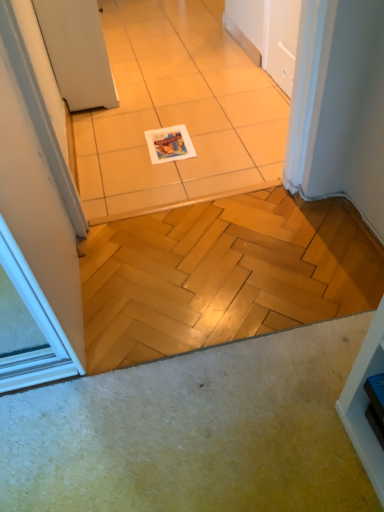
This screenshot has width=384, height=512. Identify the location of white glossy tile at center. point(177,111).

You are a GUI agent. You are given a task and a screenshot of the screen. Output one action in this format:
    pyautogui.click(x=<x>, y=<y>)
    Task: Click on the white glossy magazine at center
    This screenshot has height=512, width=384.
    Given the screenshot: What is the action you would take?
    pyautogui.click(x=169, y=144)

You are a GUI agent. You are given a task and a screenshot of the screen. Output one action in this format:
    pyautogui.click(x=<x>, y=<y>)
    Task: Click on the white glossy tile at center
    
    Given the screenshot: What is the action you would take?
    pyautogui.click(x=177, y=111)

Would you consider white glossy magazine at center to be distant from white glossy tile at center?

No.

Does point (165, 138) appear closer or farther from the camera than point (169, 42)?

Clearly, point (165, 138) is closer to the camera than point (169, 42).

Can you confirm if white glossy magazine at center is smaller than white glossy tile at center?

Indeed, white glossy magazine at center has a smaller size compared to white glossy tile at center.

Image resolution: width=384 pixels, height=512 pixels. Identify the location of magazine on the right of white glossy tile at center. (169, 144).

Is point (191, 178) closer or farther from the camera than point (59, 69)?

Point (191, 178).

In order to click on ceramic tile in front of the white matte door at upper left in this screenshot , I will do `click(177, 111)`.

Are white glossy tile at center and white matte door at upper left making contact?

No, white glossy tile at center is not touching white matte door at upper left.

Find the location of a particular element. The width and height of the screenshot is (384, 512). magazine below the white matte door at upper left (from a real-world perspective) is located at coordinates (169, 144).

Does white matte door at upper left appear on the right side of white glossy magazine at center?

Incorrect, white matte door at upper left is not on the right side of white glossy magazine at center.

Between white matte door at upper left and white glossy magazine at center, which one is positioned behind?

white glossy magazine at center.

Based on the photo, is white matte door at upper left bigger or smaller than white glossy magazine at center?

In the image, white matte door at upper left appears to be larger than white glossy magazine at center.

Would you say white glossy magazine at center is part of white glossy tile at center's contents?

Yes, white glossy magazine at center is a part of white glossy tile at center.

Does white glossy tile at center have a lesser width compared to white glossy magazine at center?

No, white glossy tile at center is not thinner than white glossy magazine at center.

The width and height of the screenshot is (384, 512). There is a white glossy tile at center. In order to click on magazine above it (from a real-world perspective) in this screenshot , I will do `click(169, 144)`.

Which is closer, (240, 161) or (188, 136)?

Point (240, 161) appears to be closer to the viewer than point (188, 136).

How many degrees apart are the facing directions of white glossy magazine at center and white matte door at upper left?

The facing directions of white glossy magazine at center and white matte door at upper left are 91.5 degrees apart.

Is white glossy magazine at center not close to white matte door at upper left?

They are positioned close to each other.

From the image's perspective, would you say white glossy magazine at center is shown under white matte door at upper left?

Yes, from the image's perspective, white glossy magazine at center is below white matte door at upper left.

Does point (175, 158) come closer to viewer compared to point (97, 53)?

Yes, it is.

Does point (54, 18) appear closer or farther from the camera than point (101, 3)?

Clearly, point (54, 18) is closer to the camera than point (101, 3).

You are a GUI agent. You are given a task and a screenshot of the screen. Output one action in this format:
    pyautogui.click(x=<x>, y=<y>)
    Task: Click on the ceramic tile located underneath the white matte door at upper left (from a real-world perspective)
    The height and width of the screenshot is (512, 384).
    Given the screenshot: What is the action you would take?
    pyautogui.click(x=177, y=111)

Is white matte door at upper left smaller than white glossy tile at center?

Actually, white matte door at upper left might be larger than white glossy tile at center.

Who is shorter, white matte door at upper left or white glossy tile at center?

With less height is white glossy tile at center.

Locate an element on the screen. ceramic tile in front of the white glossy magazine at center is located at coordinates (177, 111).

The image size is (384, 512). Identify the location of door above the white glossy tile at center (from the image's perspective). (77, 52).

Based on their spatial positions, is white glossy magazine at center or white matte door at upper left further from white glossy tile at center?

white matte door at upper left lies further to white glossy tile at center than the other object.

From the image, which object appears to be nearer to white glossy magazine at center, white matte door at upper left or white glossy tile at center?

white glossy tile at center.

When comparing their distances from white glossy tile at center, does white matte door at upper left or white glossy magazine at center seem closer?

The object closer to white glossy tile at center is white glossy magazine at center.

Considering their positions, is white glossy tile at center positioned further to white matte door at upper left than white glossy magazine at center?

white glossy magazine at center is further to white matte door at upper left.

In the scene shown: Looking at the image, which one is located further to white matte door at upper left, white glossy magazine at center or white glossy tile at center?

white glossy magazine at center lies further to white matte door at upper left than the other object.

Looking at the image, which one is located further to white glossy magazine at center, white glossy tile at center or white matte door at upper left?

white matte door at upper left.

Identify the location of ceramic tile between white matte door at upper left and white glossy magazine at center vertically. (177, 111).